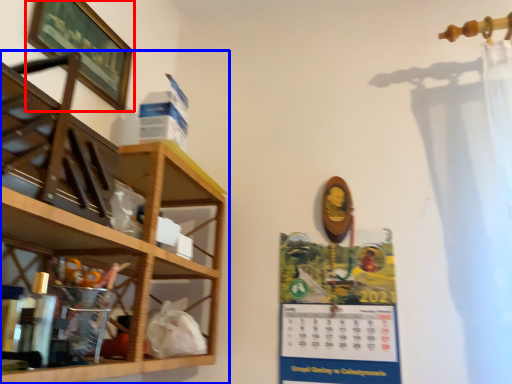
Question: Among these objects, which one is farthest to the camera, picture frame (highlighted by a red box) or shelf (highlighted by a blue box)?

Choices:
 (A) picture frame
 (B) shelf

Answer: (A)